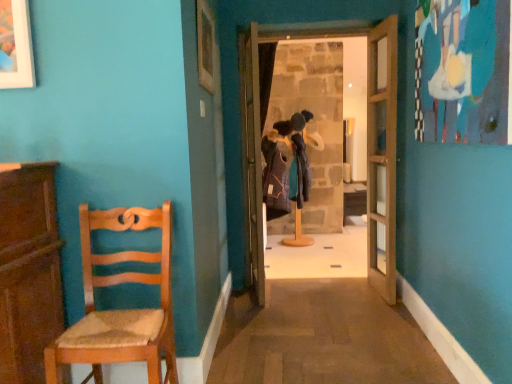
Question: Which direction should I rotate to look at wooden coat rack at center, which is the second door in right-to-left order?

Choices:
 (A) left
 (B) right

Answer: (B)

Question: Is wooden picture frame at upper center facing away from wooden door at center, placed as the third door when sorted from left to right?

Choices:
 (A) no
 (B) yes

Answer: (A)

Question: Does wooden picture frame at upper center have a smaller size compared to wooden door at center, the 1th door from the right?

Choices:
 (A) no
 (B) yes

Answer: (B)

Question: From a real-world perspective, is wooden picture frame at upper center positioned over wooden door at center, the 1th door from the right, based on gravity?

Choices:
 (A) yes
 (B) no

Answer: (A)

Question: From the image's perspective, is wooden picture frame at upper center above wooden door at center, placed as the third door when sorted from left to right?

Choices:
 (A) no
 (B) yes

Answer: (B)

Question: Is wooden picture frame at upper center taller than wooden door at center, placed as the third door when sorted from left to right?

Choices:
 (A) yes
 (B) no

Answer: (B)

Question: Would you say wooden picture frame at upper center contains wooden door at center, placed as the third door when sorted from left to right?

Choices:
 (A) yes
 (B) no

Answer: (B)

Question: From the image's perspective, is wooden coat rack at center, which is counted as the second door, starting from the left, below wooden door at center, placed as the third door when sorted from left to right?

Choices:
 (A) no
 (B) yes

Answer: (A)

Question: Is wooden coat rack at center, which is the second door in right-to-left order, closer to camera compared to wooden door at center, the 1th door from the right?

Choices:
 (A) yes
 (B) no

Answer: (B)

Question: Could you tell me if wooden coat rack at center, which is the second door in right-to-left order, is facing wooden door at center, the 1th door from the right?

Choices:
 (A) no
 (B) yes

Answer: (A)

Question: Is wooden coat rack at center, which is counted as the second door, starting from the left, next to wooden door at center, placed as the third door when sorted from left to right?

Choices:
 (A) no
 (B) yes

Answer: (A)

Question: Can you confirm if wooden coat rack at center, which is counted as the second door, starting from the left, is shorter than wooden door at center, placed as the third door when sorted from left to right?

Choices:
 (A) yes
 (B) no

Answer: (A)

Question: Could wooden door at center, placed as the third door when sorted from left to right, be considered to be inside wooden coat rack at center, which is counted as the second door, starting from the left?

Choices:
 (A) yes
 (B) no

Answer: (B)

Question: Is wooden door at center, placed as the third door when sorted from left to right, facing away from wooden table at center?

Choices:
 (A) yes
 (B) no

Answer: (B)